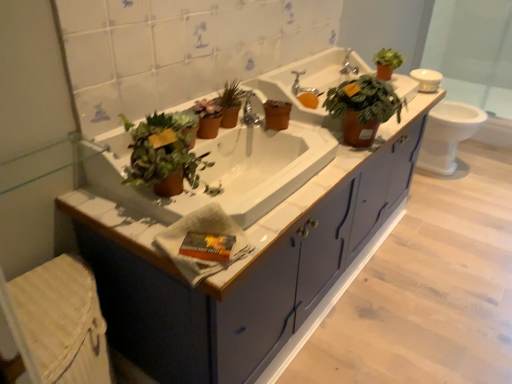
The image size is (512, 384). In order to click on free location above matte blue cabinet at center (from a real-world perspective) in this screenshot , I will do `click(348, 263)`.